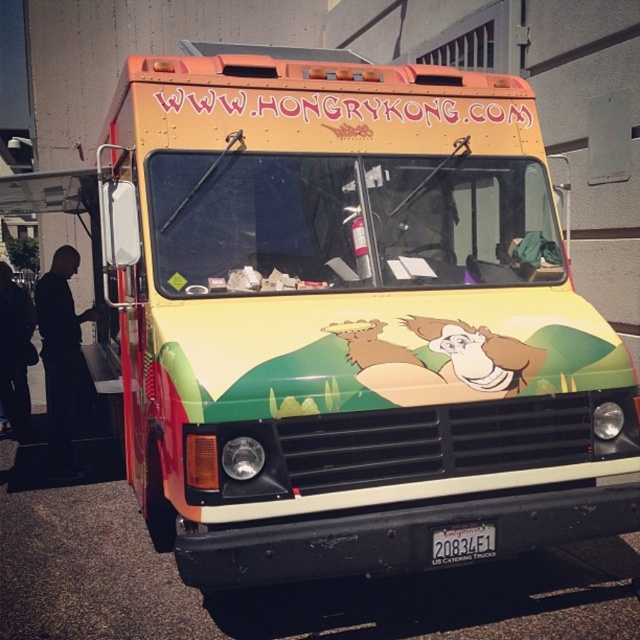
Question: Observing the image, what is the correct spatial positioning of black fabric pants at left in reference to white plastic license plate at center?

Choices:
 (A) below
 (B) above

Answer: (B)

Question: Does black fabric pants at left appear on the left side of white plastic license plate at center?

Choices:
 (A) no
 (B) yes

Answer: (B)

Question: Among these points, which one is nearest to the camera?

Choices:
 (A) (29, 332)
 (B) (56, 401)

Answer: (B)

Question: Among these points, which one is farthest from the camera?

Choices:
 (A) coord(22,349)
 (B) coord(474,548)

Answer: (A)

Question: Among these points, which one is nearest to the camera?

Choices:
 (A) (42, 312)
 (B) (10, 419)

Answer: (A)

Question: Is black matte clothing at left above white plastic license plate at center?

Choices:
 (A) yes
 (B) no

Answer: (A)